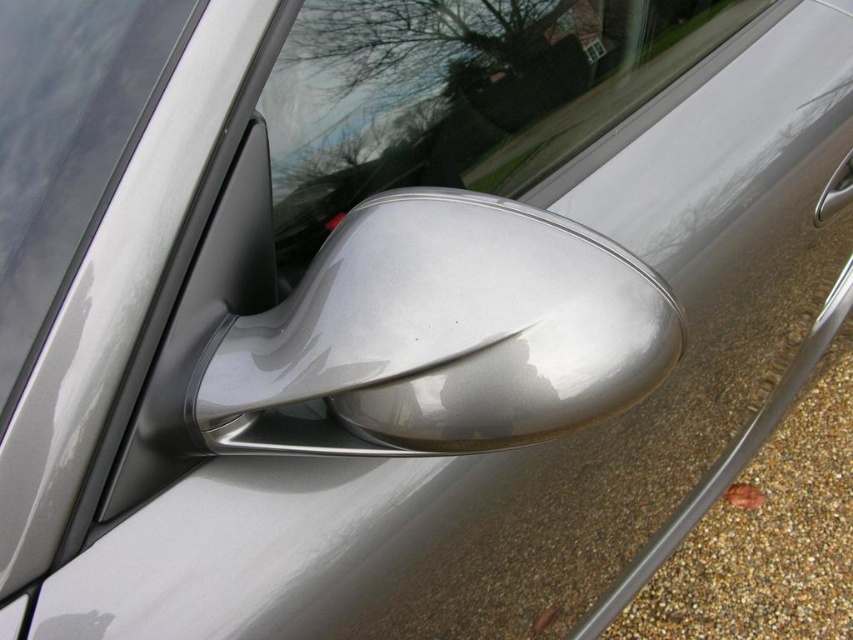
You are a car detailer inspecting the satin silver mirror at center and the polished silver door handle at lower right. Which object is positioned higher on the car body?

The polished silver door handle at lower right is positioned higher than the satin silver mirror at center because the satin silver mirror at center is located below it.

You are a photographer adjusting your camera to focus on two points on the car mirror. The points are labeled as point (572, 396) and point (335, 3). Which point should you focus on first if you want to ensure the closest one is in sharp focus?

Point (572, 396) is closer to the camera than point (335, 3), so you should focus on point (572, 396) first to ensure it is in sharp focus.

You are a car designer evaluating the placement of the satin silver mirror at center for aerodynamics. Based on its position coordinates, is it located closer to the front or rear of the car?

The satin silver mirror at center is located at coordinates point (440, 336), which places it closer to the front of the car since the lower y value indicates proximity to the front.